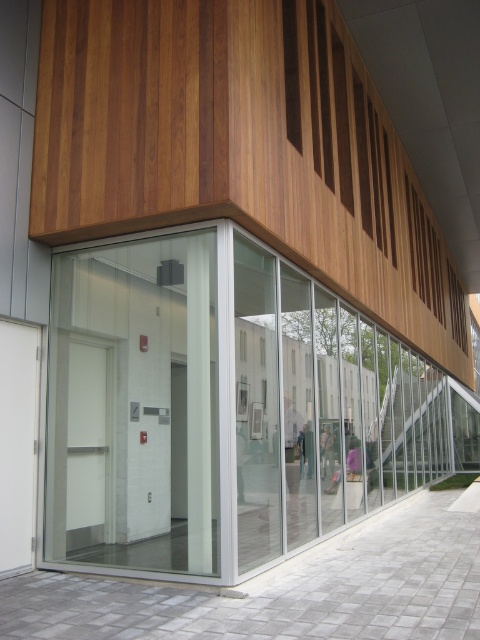
Question: Is transparent glass door at center above transparent glass elevator at center?

Choices:
 (A) no
 (B) yes

Answer: (A)

Question: Which point is closer to the camera?

Choices:
 (A) transparent glass door at center
 (B) transparent glass elevator at center

Answer: (A)

Question: Does transparent glass door at center have a greater width compared to transparent glass elevator at center?

Choices:
 (A) yes
 (B) no

Answer: (A)

Question: Is transparent glass door at center to the right of transparent glass elevator at center from the viewer's perspective?

Choices:
 (A) no
 (B) yes

Answer: (B)

Question: Which object appears farthest from the camera in this image?

Choices:
 (A) transparent glass elevator at center
 (B) transparent glass door at center

Answer: (A)